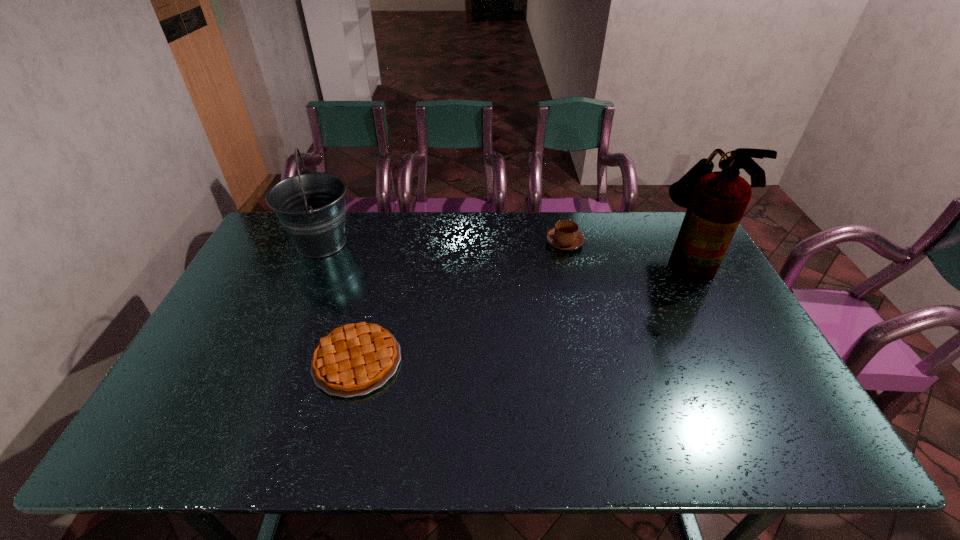
The image size is (960, 540). Find the location of `free space between the fire extinguisher and the second shortest object`. free space between the fire extinguisher and the second shortest object is located at coordinates (625, 250).

Identify the location of free space between the pie and the bucket. Image resolution: width=960 pixels, height=540 pixels. (340, 302).

Locate an element on the screen. free space that is in between the third object from left to right and the third shortest object is located at coordinates (444, 242).

Find the location of a particular element. unoccupied area between the tallest object and the second tallest object is located at coordinates (504, 251).

Locate an element on the screen. free point between the fire extinguisher and the second tallest object is located at coordinates (504, 251).

This screenshot has height=540, width=960. In order to click on object that is the nearest to the cappuccino in this screenshot , I will do `click(716, 201)`.

The width and height of the screenshot is (960, 540). In order to click on object that is the closest one to the fire extinguisher in this screenshot , I will do `click(565, 236)`.

I want to click on vacant space that satisfies the following two spatial constraints: 1. at the nozzle of the fire extinguisher; 2. on the front side of the shortest object, so click(741, 361).